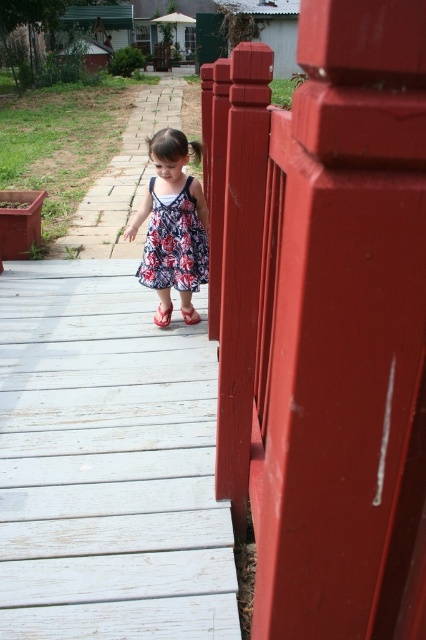
In the scene shown: You are a photographer trying to capture a closeup of the smooth glossy wood at right and the red rubber sandal at center. Since you want both objects in the frame, which direction should you move the camera to ensure both are visible?

The smooth glossy wood at right is to the right of the red rubber sandal at center, so you should move the camera to the left to include both objects in the frame.

You are a photographer standing on the wooden deck and want to take a photo of the floral dress at center and the brick paved path at center. Which object is located to the right of the other?

The floral dress at center is positioned on the right side of brick paved path at center, so the floral dress at center is to the right of the brick paved path at center.

Looking at this image, you are a photographer trying to capture the child in the floral dress at center without the brick paved path at center appearing in the background. Is this possible based on their positions?

The floral dress at center is in front of the brick paved path at center, so yes, the photographer can capture the child in the floral dress at center without the brick paved path at center in the background by focusing on the foreground where the dress is positioned.